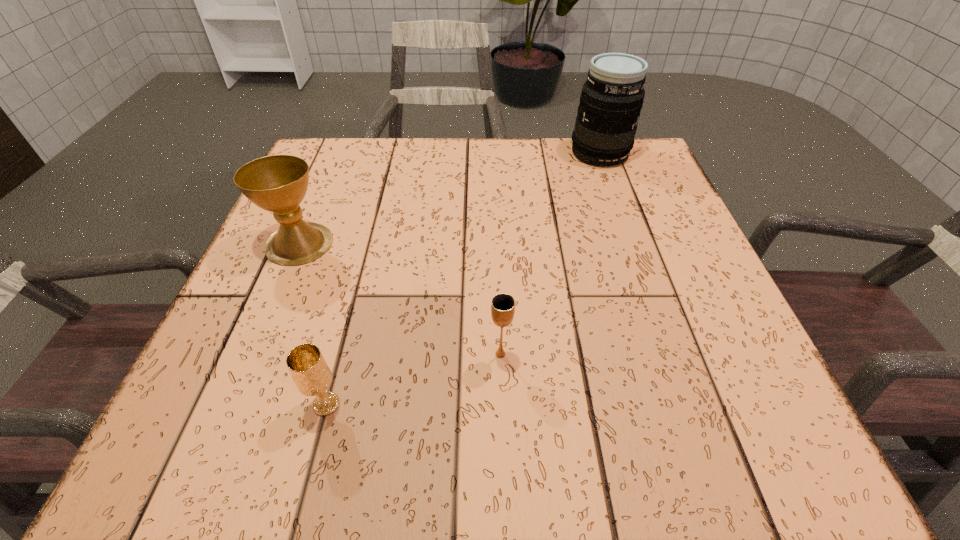
Where is `vacant point located 0.080m on the right of the second nearest object`? vacant point located 0.080m on the right of the second nearest object is located at coordinates (560, 354).

Where is `vacant space located on the right of the nearest object`? This screenshot has width=960, height=540. vacant space located on the right of the nearest object is located at coordinates (529, 404).

At what (x,y) coordinates should I click in order to perform the action: click on object that is at the far edge. Please return your answer as a coordinate pair (x, y). The height and width of the screenshot is (540, 960). Looking at the image, I should click on (612, 97).

Find the location of `object that is at the near edge`. object that is at the near edge is located at coordinates (308, 368).

Locate an element on the screen. The image size is (960, 540). object that is at the left edge is located at coordinates (278, 183).

Where is `object that is at the right edge`? object that is at the right edge is located at coordinates (612, 97).

The image size is (960, 540). What are the coordinates of `object that is at the far right corner` in the screenshot? It's located at (612, 97).

Where is `vacant area at the far edge of the desktop`? vacant area at the far edge of the desktop is located at coordinates (508, 179).

Locate an element on the screen. This screenshot has height=540, width=960. vacant position at the near edge of the desktop is located at coordinates (343, 430).

Locate an element on the screen. The height and width of the screenshot is (540, 960). free space at the left edge of the desktop is located at coordinates (314, 282).